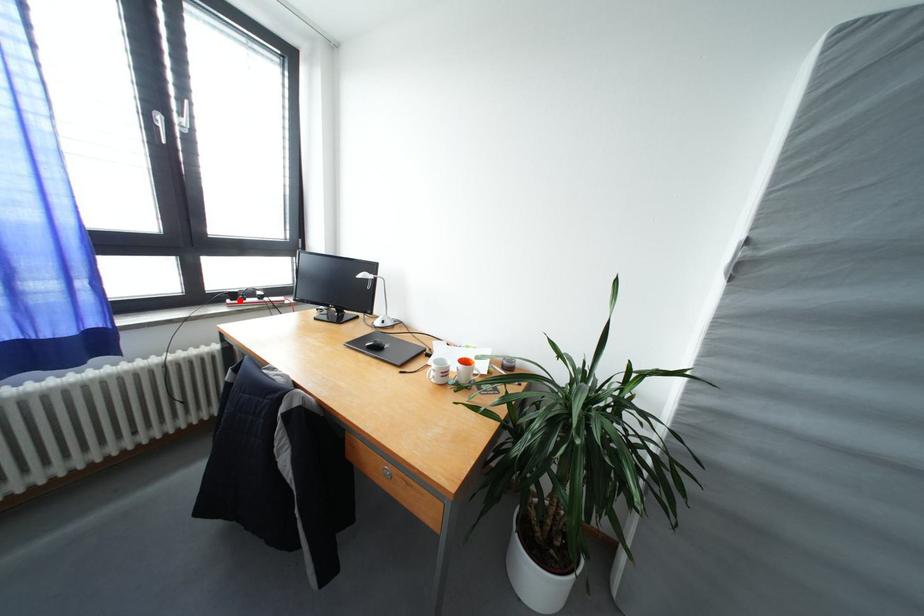
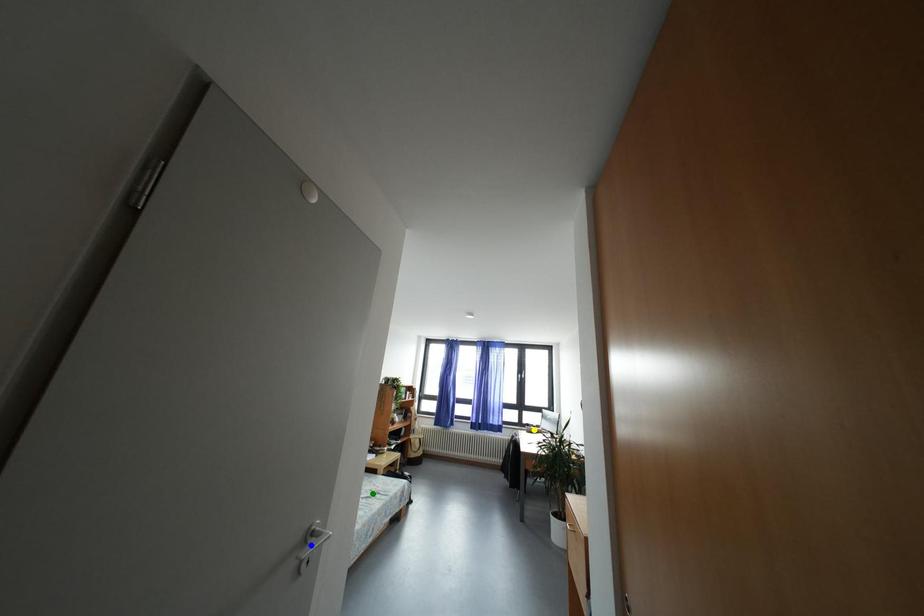
Question: I am providing you with two images of the same scene from different viewpoints. A red point is marked on the first image. You are given multiple points on the second image. Which point in image 2 is actually the same real-world point as the red point in image 1?

Choices:
 (A) yellow point
 (B) green point
 (C) blue point

Answer: (A)